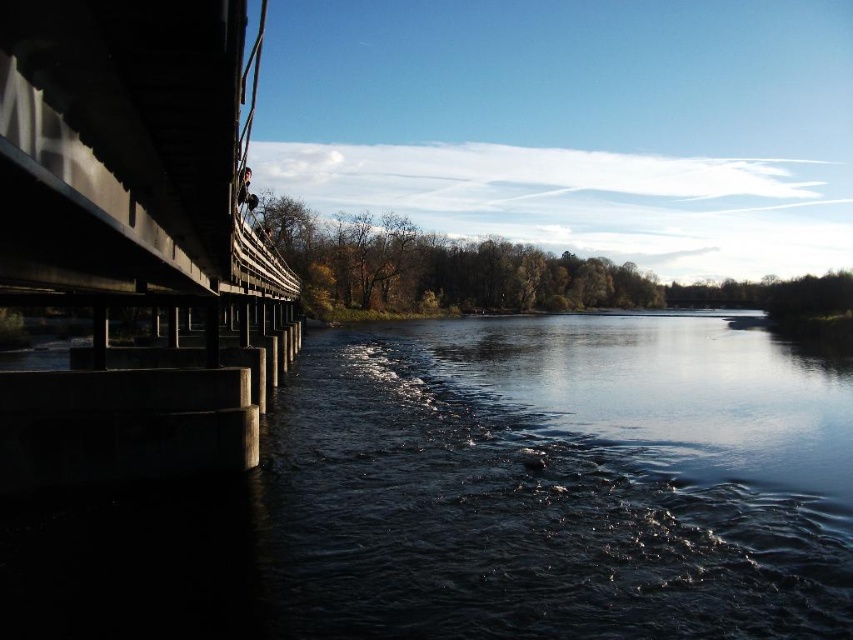
Question: From the image, what is the correct spatial relationship of dark concrete water at lower left in relation to concrete bridge at left?

Choices:
 (A) left
 (B) right

Answer: (B)

Question: Which point is farther to the camera?

Choices:
 (A) (815, 561)
 (B) (20, 152)

Answer: (A)

Question: Is dark concrete water at lower left below concrete bridge at left?

Choices:
 (A) yes
 (B) no

Answer: (A)

Question: Which point is closer to the camera?

Choices:
 (A) dark concrete water at lower left
 (B) concrete bridge at left

Answer: (B)

Question: Is dark concrete water at lower left positioned in front of concrete bridge at left?

Choices:
 (A) yes
 (B) no

Answer: (B)